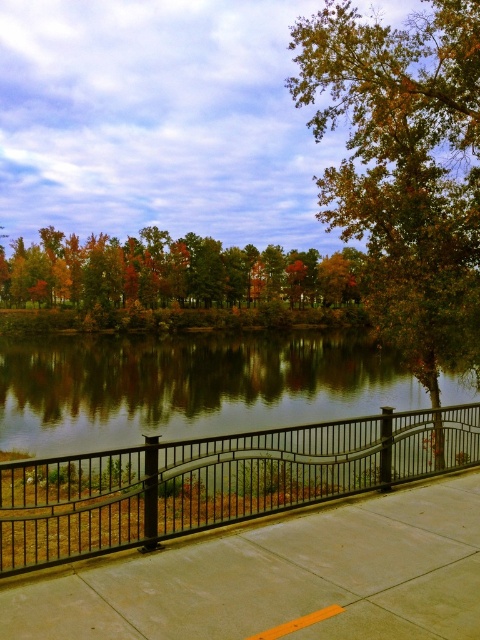
You are standing on the concrete at center and want to reach the golden leaves tree at center. Which direction should you move to get closer to the tree?

Since the concrete at center is closer to the viewer than the golden leaves tree at center, you should move forward away from the railing to reach the golden leaves tree at center.

You are standing on the curved black metal railing in the foreground. You want to place a small decorative stone on the golden leaves tree at center and the glossy black water at center. Which object can you place the stone on?

The glossy black water at center is below the golden leaves tree at center, so you can place the stone on the glossy black water at center but not on the golden leaves tree at center since it is above.